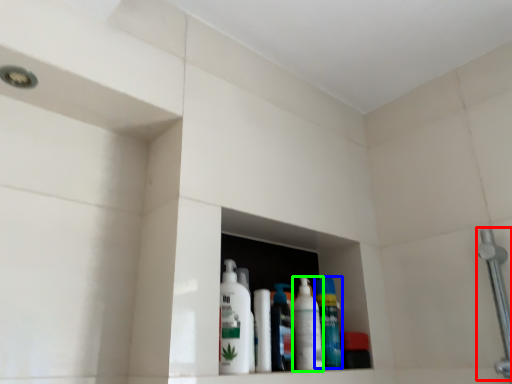
Question: Considering the real-world distances, which object is closest to shower (highlighted by a red box)? cleaning product (highlighted by a blue box) or cleaning product (highlighted by a green box).

Choices:
 (A) cleaning product
 (B) cleaning product

Answer: (A)